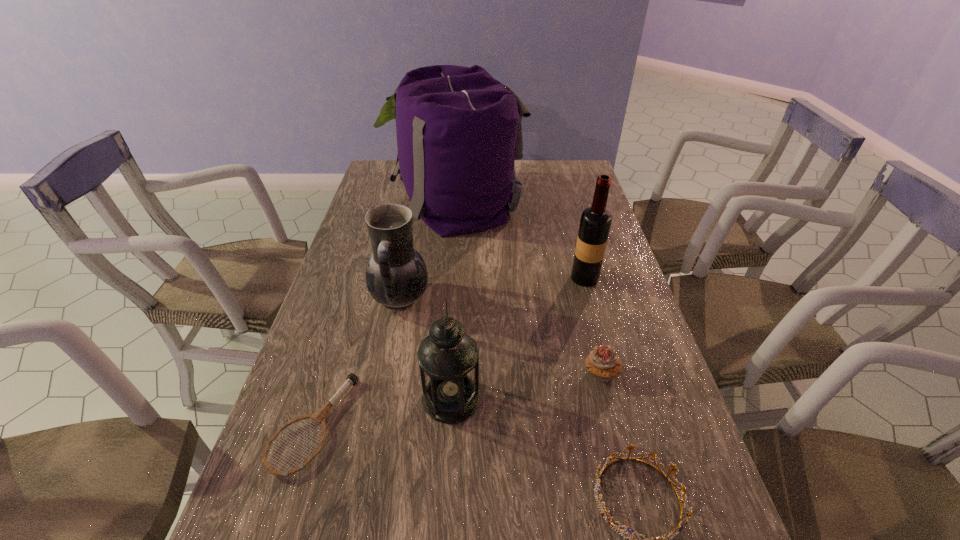
At what (x,y) coordinates should I click in order to perform the action: click on the closest object relative to the wine bottle. Please return your answer as a coordinate pair (x, y). The image size is (960, 540). Looking at the image, I should click on (459, 131).

Select which object appears as the fifth closest to the oil lamp. Please provide its 2D coordinates. Your answer should be formatted as a tuple, i.e. [(x, y)], where the tuple contains the x and y coordinates of a point satisfying the conditions above.

[(595, 223)]

Where is `vacant space that satisfies the following two spatial constraints: 1. on the back side of the third shortest object; 2. on the left side of the oil lamp`? vacant space that satisfies the following two spatial constraints: 1. on the back side of the third shortest object; 2. on the left side of the oil lamp is located at coordinates (453, 373).

Find the location of a particular element. The image size is (960, 540). vacant position in the image that satisfies the following two spatial constraints: 1. on the front pocket of the fifth tallest object; 2. on the left side of the tallest object is located at coordinates (444, 373).

What are the coordinates of `free location that satisfies the following two spatial constraints: 1. on the front pocket of the wine bottle; 2. on the right side of the tallest object` in the screenshot? It's located at (451, 278).

You are a GUI agent. You are given a task and a screenshot of the screen. Output one action in this format:
    pyautogui.click(x=<x>, y=<y>)
    Task: Click on the free location that satisfies the following two spatial constraints: 1. on the front-facing side of the oil lamp; 2. on the left side of the pitcher
    This screenshot has height=540, width=960.
    Given the screenshot: What is the action you would take?
    pyautogui.click(x=380, y=399)

This screenshot has width=960, height=540. Identify the location of free spot that satisfies the following two spatial constraints: 1. on the front pocket of the tallest object; 2. on the right side of the wine bottle. (451, 278).

Locate an element on the screen. The image size is (960, 540). vacant space that satisfies the following two spatial constraints: 1. on the back side of the cupcake; 2. on the front pocket of the tallest object is located at coordinates (558, 200).

You are a GUI agent. You are given a task and a screenshot of the screen. Output one action in this format:
    pyautogui.click(x=<x>, y=<y>)
    Task: Click on the free spot that satisfies the following two spatial constraints: 1. on the front-facing side of the pitcher; 2. on the right side of the oil lamp
    This screenshot has height=540, width=960.
    Given the screenshot: What is the action you would take?
    pyautogui.click(x=380, y=399)